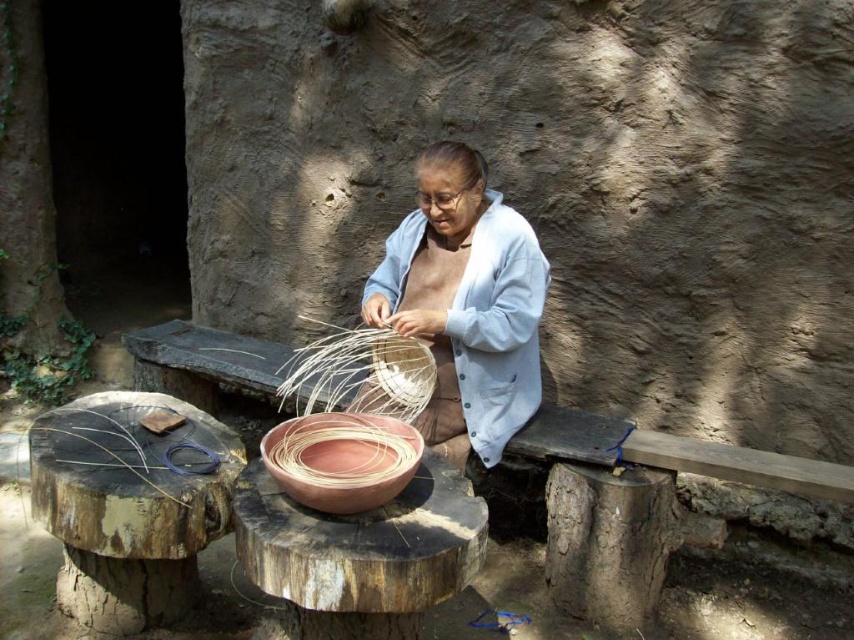
Question: Does light blue fabric at center have a larger size compared to terracotta woven basket at center?

Choices:
 (A) no
 (B) yes

Answer: (B)

Question: In this image, where is light blue fabric at center located relative to terracotta woven basket at center?

Choices:
 (A) right
 (B) left

Answer: (A)

Question: Is light blue fabric at center to the right of terracotta woven basket at center from the viewer's perspective?

Choices:
 (A) no
 (B) yes

Answer: (B)